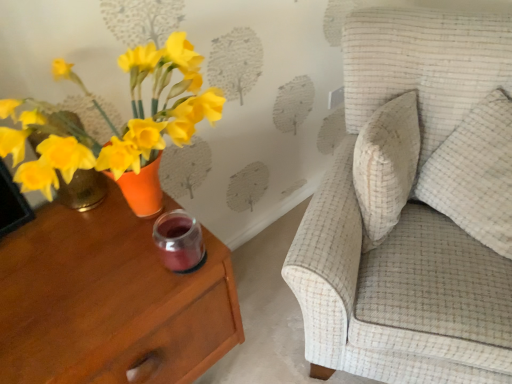
Question: Considering the relative sizes of white textured pillow at right and textured beige sofa at upper right in the image provided, is white textured pillow at right smaller than textured beige sofa at upper right?

Choices:
 (A) yes
 (B) no

Answer: (A)

Question: From the image's perspective, would you say white textured pillow at right is shown under textured beige sofa at upper right?

Choices:
 (A) no
 (B) yes

Answer: (A)

Question: From a real-world perspective, is white textured pillow at right on top of textured beige sofa at upper right?

Choices:
 (A) no
 (B) yes

Answer: (B)

Question: Is white textured pillow at right positioned beyond the bounds of textured beige sofa at upper right?

Choices:
 (A) yes
 (B) no

Answer: (B)

Question: Is white textured pillow at right wider than textured beige sofa at upper right?

Choices:
 (A) no
 (B) yes

Answer: (A)

Question: Is white textured pillow at right directly adjacent to textured beige sofa at upper right?

Choices:
 (A) yes
 (B) no

Answer: (B)

Question: Is white textured pillow at right behind matte wood nightstand at left?

Choices:
 (A) no
 (B) yes

Answer: (B)

Question: Is white textured pillow at right thinner than matte wood nightstand at left?

Choices:
 (A) no
 (B) yes

Answer: (B)

Question: From a real-world perspective, is white textured pillow at right physically below matte wood nightstand at left?

Choices:
 (A) yes
 (B) no

Answer: (B)

Question: From the image's perspective, would you say white textured pillow at right is shown under matte wood nightstand at left?

Choices:
 (A) no
 (B) yes

Answer: (A)

Question: Is matte wood nightstand at left inside white textured pillow at right?

Choices:
 (A) no
 (B) yes

Answer: (A)

Question: Would you consider white textured pillow at right to be distant from matte wood nightstand at left?

Choices:
 (A) no
 (B) yes

Answer: (A)

Question: From the image's perspective, is textured beige sofa at upper right located beneath white textured pillow at right?

Choices:
 (A) no
 (B) yes

Answer: (B)